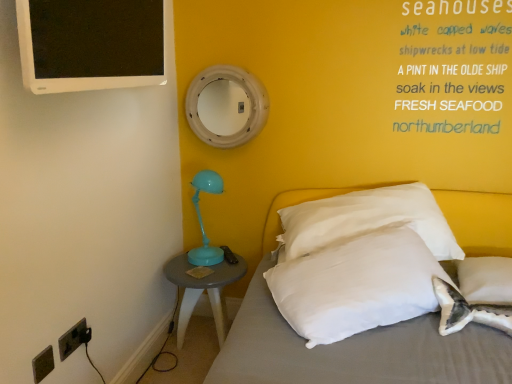
What is the approximate height of matte gray side table at lower left?

The height of matte gray side table at lower left is 17.47 inches.

This screenshot has height=384, width=512. What are the coordinates of `black plastic electrical outlet at lower left, positioned as the 1th electric outlet in back-to-front order` in the screenshot? It's located at (71, 339).

Image resolution: width=512 pixels, height=384 pixels. Identify the location of white painted wood mirror at upper center. (226, 106).

Measure the distance between point (436, 343) and camera.

The depth of point (436, 343) is 1.37 meters.

Locate an element on the screen. Image resolution: width=512 pixels, height=384 pixels. white fabric bed at lower right is located at coordinates (349, 338).

Where is `white glossy computer monitor at upper left`? The image size is (512, 384). white glossy computer monitor at upper left is located at coordinates (91, 44).

Locate an element on the screen. The image size is (512, 384). matte gray side table at lower left is located at coordinates (202, 291).

Is point (259, 317) closer or farther from the camera than point (322, 257)?

Point (259, 317).

Which object is closer to the camera, white fabric bed at lower right or white soft pillow at center, the first pillow viewed from the left?

white fabric bed at lower right.

Is white fabric bed at lower right far away from white soft pillow at center, the 2th pillow viewed from the right?

No.

Does white fabric bed at lower right turn towards white soft pillow at center, the first pillow viewed from the left?

No.

Is the surface of white soft pillow at center, the first pillow viewed from the left, in direct contact with dark gray plastic outlet at lower left, the first electric outlet when ordered from front to back?

There is a gap between white soft pillow at center, the first pillow viewed from the left, and dark gray plastic outlet at lower left, the first electric outlet when ordered from front to back.

Would you say white soft pillow at center, the first pillow viewed from the left, is to the left or to the right of dark gray plastic outlet at lower left, the second electric outlet positioned from the back, in the picture?

Based on their positions, white soft pillow at center, the first pillow viewed from the left, is located to the right of dark gray plastic outlet at lower left, the second electric outlet positioned from the back.

Could you tell me if white soft pillow at center, the 2th pillow viewed from the right, is turned towards dark gray plastic outlet at lower left, the second electric outlet positioned from the back?

No, white soft pillow at center, the 2th pillow viewed from the right, is not turned towards dark gray plastic outlet at lower left, the second electric outlet positioned from the back.

Which object is thinner, white soft pillow at center, the 2th pillow viewed from the right, or dark gray plastic outlet at lower left, the first electric outlet when ordered from front to back?

dark gray plastic outlet at lower left, the first electric outlet when ordered from front to back.

Is the surface of white painted wood mirror at upper center in direct contact with white soft pillow at center, the first pillow viewed from the left?

No, white painted wood mirror at upper center is not making contact with white soft pillow at center, the first pillow viewed from the left.

What's the angular difference between white painted wood mirror at upper center and white soft pillow at center, the first pillow viewed from the left,'s facing directions?

34 degrees.

Which is less distant, (210, 100) or (309, 274)?

Clearly, point (210, 100) is more distant from the camera than point (309, 274).

Considering the positions of objects white painted wood mirror at upper center and white soft pillow at center, the 2th pillow viewed from the right, in the image provided, who is more to the right, white painted wood mirror at upper center or white soft pillow at center, the 2th pillow viewed from the right,?

Positioned to the right is white soft pillow at center, the 2th pillow viewed from the right.

Is white painted wood mirror at upper center taller than matte gray side table at lower left?

No, white painted wood mirror at upper center is not taller than matte gray side table at lower left.

Is point (213, 144) positioned in front of point (187, 311)?

No, (213, 144) is further to viewer.

Which object is further away from the camera, white painted wood mirror at upper center or matte gray side table at lower left?

Positioned behind is white painted wood mirror at upper center.

Between white fabric bed at lower right and white painted wood mirror at upper center, which one has larger size?

white fabric bed at lower right is bigger.

Is white fabric bed at lower right not close to white painted wood mirror at upper center?

No, white fabric bed at lower right is not far away from white painted wood mirror at upper center.

Is white painted wood mirror at upper center at the back of white fabric bed at lower right?

That's not correct — white fabric bed at lower right is not looking away from white painted wood mirror at upper center.

From a real-world perspective, is white fabric bed at lower right under white painted wood mirror at upper center?

Indeed, from a real-world perspective, white fabric bed at lower right is positioned beneath white painted wood mirror at upper center.

Do you think white soft pillow at center, the first pillow viewed from the left, is within matte gray side table at lower left, or outside of it?

white soft pillow at center, the first pillow viewed from the left, cannot be found inside matte gray side table at lower left.

Does point (295, 306) come farther from viewer compared to point (234, 276)?

No, (295, 306) is closer to viewer.

Considering the relative sizes of white soft pillow at center, the first pillow viewed from the left, and matte gray side table at lower left in the image provided, is white soft pillow at center, the first pillow viewed from the left, taller than matte gray side table at lower left?

No.

Is white soft pillow at center, the first pillow viewed from the left, next to matte gray side table at lower left and touching it?

white soft pillow at center, the first pillow viewed from the left, and matte gray side table at lower left are clearly separated.

Is white soft pillow at center, the 2th pillow viewed from the right, completely or partially inside black plastic electrical outlet at lower left, positioned as the 1th electric outlet in back-to-front order?

No, white soft pillow at center, the 2th pillow viewed from the right, is located outside of black plastic electrical outlet at lower left, positioned as the 1th electric outlet in back-to-front order.

Does black plastic electrical outlet at lower left, positioned as the 1th electric outlet in back-to-front order, appear on the right side of white soft pillow at center, the first pillow viewed from the left?

In fact, black plastic electrical outlet at lower left, positioned as the 1th electric outlet in back-to-front order, is to the left of white soft pillow at center, the first pillow viewed from the left.

What's the angular difference between black plastic electrical outlet at lower left, positioned as the 1th electric outlet in back-to-front order, and white soft pillow at center, the 2th pillow viewed from the right,'s facing directions?

The angle between the facing direction of black plastic electrical outlet at lower left, positioned as the 1th electric outlet in back-to-front order, and the facing direction of white soft pillow at center, the 2th pillow viewed from the right, is 52.3 degrees.

The height and width of the screenshot is (384, 512). There is a black plastic electrical outlet at lower left, positioned as the 1th electric outlet in back-to-front order. Identify the location of the 2nd pillow above it (from the image's perspective). (356, 285).

The image size is (512, 384). I want to click on pillow that is the 2nd object above the white fabric bed at lower right (from a real-world perspective), so click(x=356, y=285).

Locate an element on the screen. The width and height of the screenshot is (512, 384). electric outlet that is the 2nd one when counting downward from the white soft pillow at center, the 2th pillow viewed from the right (from the image's perspective) is located at coordinates (42, 364).

Based on their spatial positions, is dark gray plastic outlet at lower left, the first electric outlet when ordered from front to back, or black plastic electrical outlet at lower left, positioned as the 1th electric outlet in back-to-front order, closer to white glossy computer monitor at upper left?

black plastic electrical outlet at lower left, positioned as the 1th electric outlet in back-to-front order, is positioned closer to the anchor white glossy computer monitor at upper left.

When comparing their distances from black plastic electrical outlet at lower left, placed as the 2th electric outlet when sorted from front to back, does white soft pillow at right, which ranks as the second pillow in left-to-right order, or matte gray side table at lower left seem further?

Based on the image, white soft pillow at right, which ranks as the second pillow in left-to-right order, appears to be further to black plastic electrical outlet at lower left, placed as the 2th electric outlet when sorted from front to back.

Based on their spatial positions, is white fabric bed at lower right or white soft pillow at right, which ranks as the second pillow in left-to-right order, further from white glossy computer monitor at upper left?

The object further to white glossy computer monitor at upper left is white soft pillow at right, which ranks as the second pillow in left-to-right order.

Looking at the image, which one is located further to dark gray plastic outlet at lower left, the first electric outlet when ordered from front to back, white soft pillow at right, which ranks as the second pillow in left-to-right order, or white fabric bed at lower right?

white soft pillow at right, which ranks as the second pillow in left-to-right order, is positioned further to the anchor dark gray plastic outlet at lower left, the first electric outlet when ordered from front to back.

Considering their positions, is white painted wood mirror at upper center positioned closer to dark gray plastic outlet at lower left, the second electric outlet positioned from the back, than white glossy computer monitor at upper left?

white glossy computer monitor at upper left lies closer to dark gray plastic outlet at lower left, the second electric outlet positioned from the back, than the other object.

Based on their spatial positions, is white glossy computer monitor at upper left or matte gray side table at lower left further from dark gray plastic outlet at lower left, the second electric outlet positioned from the back?

white glossy computer monitor at upper left.

Based on the photo, based on their spatial positions, is dark gray plastic outlet at lower left, the second electric outlet positioned from the back, or white fabric bed at lower right closer to white glossy computer monitor at upper left?

Based on the image, dark gray plastic outlet at lower left, the second electric outlet positioned from the back, appears to be nearer to white glossy computer monitor at upper left.

Considering their positions, is dark gray plastic outlet at lower left, the first electric outlet when ordered from front to back, positioned further to black plastic electrical outlet at lower left, placed as the 2th electric outlet when sorted from front to back, than white fabric bed at lower right?

white fabric bed at lower right is positioned further to the anchor black plastic electrical outlet at lower left, placed as the 2th electric outlet when sorted from front to back.

Locate an element on the screen. The image size is (512, 384). computer monitor located between dark gray plastic outlet at lower left, the second electric outlet positioned from the back, and white soft pillow at center, the first pillow viewed from the left, in the left-right direction is located at coordinates (91, 44).

Where is `pillow situated between dark gray plastic outlet at lower left, the second electric outlet positioned from the back, and white fabric bed at lower right from left to right`? This screenshot has width=512, height=384. pillow situated between dark gray plastic outlet at lower left, the second electric outlet positioned from the back, and white fabric bed at lower right from left to right is located at coordinates (356, 285).

The image size is (512, 384). I want to click on electric outlet located between dark gray plastic outlet at lower left, the first electric outlet when ordered from front to back, and matte gray side table at lower left in the depth direction, so click(71, 339).

You are a GUI agent. You are given a task and a screenshot of the screen. Output one action in this format:
    pyautogui.click(x=<x>, y=<y>)
    Task: Click on the mirror between dark gray plastic outlet at lower left, the second electric outlet positioned from the back, and white soft pillow at center, the 2th pillow viewed from the right, in the horizontal direction
    The image size is (512, 384).
    Given the screenshot: What is the action you would take?
    pyautogui.click(x=226, y=106)